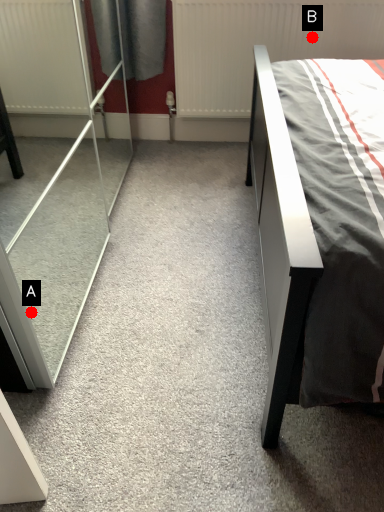
Question: Two points are circled on the image, labeled by A and B beside each circle. Which point appears farthest from the camera in this image?

Choices:
 (A) A is further
 (B) B is further

Answer: (B)